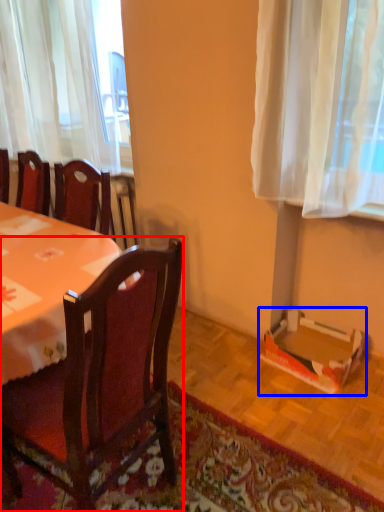
Question: Which object appears farthest to the camera in this image, chair (highlighted by a red box) or cardboard box (highlighted by a blue box)?

Choices:
 (A) chair
 (B) cardboard box

Answer: (B)